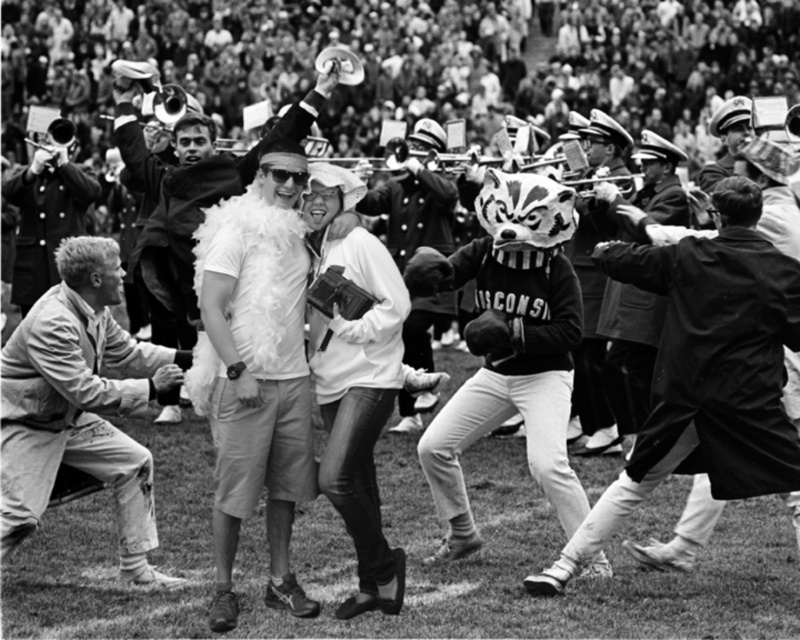
Question: Can you confirm if light beige cotton jacket at lower left is positioned to the right of smooth leather jacket at left?

Choices:
 (A) yes
 (B) no

Answer: (A)

Question: Estimate the real-world distances between objects in this image. Which object is farther from the smooth leather jacket at left?

Choices:
 (A) smooth black coat at right
 (B) white feather boa at center
 (C) white fluffy boa at center
 (D) light beige cotton jacket at lower left

Answer: (A)

Question: Is smooth black coat at right above smooth leather jacket at left?

Choices:
 (A) yes
 (B) no

Answer: (B)

Question: Considering the real-world distances, which object is closest to the white feather boa at center?

Choices:
 (A) light beige cotton jacket at lower left
 (B) white fluffy boa at center

Answer: (B)

Question: Does light beige cotton jacket at lower left come in front of white fluffy boa at center?

Choices:
 (A) no
 (B) yes

Answer: (B)

Question: Estimate the real-world distances between objects in this image. Which object is closer to the smooth leather jacket at left?

Choices:
 (A) light beige cotton jacket at lower left
 (B) smooth black coat at right

Answer: (A)